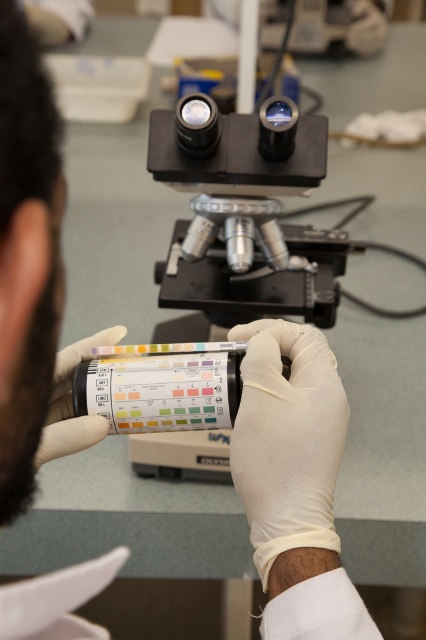
You are a lab technician who needs to place both the metallic silver microscope at center and the white matte glove at center on a shelf. The shelf has a maximum weight capacity of 10 kilograms. If the microscope weighs 8 kilograms and the glove weighs 1 kilogram, can both items be placed on the shelf together without exceeding the weight limit?

The metallic silver microscope at center weighs 8 kilograms and the white matte glove at center weighs 1 kilogram. Together, they total 9 kilograms, which is under the 10 kilogram limit. Therefore, both items can be placed on the shelf safely.

You are a lab technician who needs to place the white latex glove at center onto a shelf that is 16 inches away from you. Can you safely place it without overreaching?

The white latex glove at center is 16.51 inches away from the viewer. Since the shelf is only 16 inches away, you are slightly too far to safely reach it without overextending.